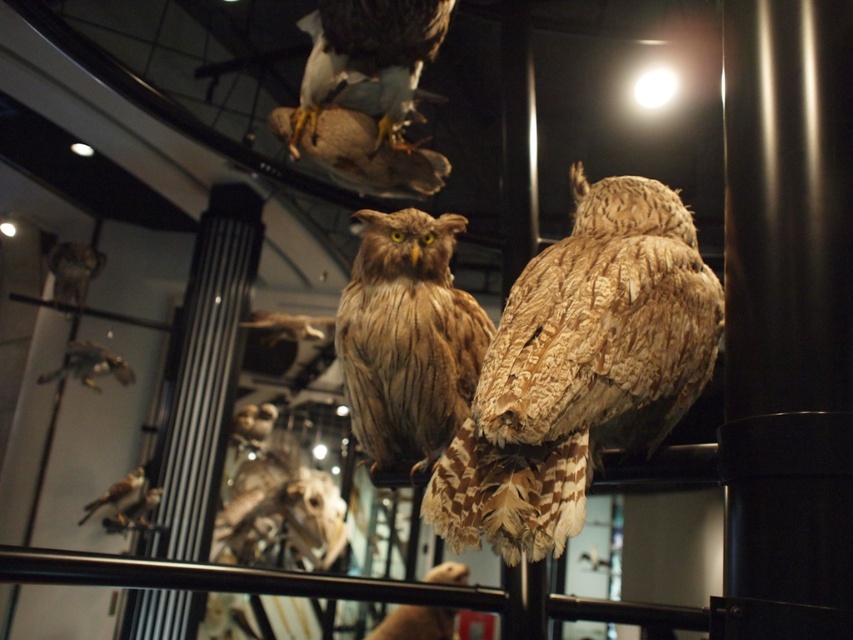
Between brown textured owl at center and brown feathered owl at lower left, which one appears on the left side from the viewer's perspective?

brown feathered owl at lower left is more to the left.

Is brown textured owl at center further to the viewer compared to brown feathered owl at lower left?

No, brown textured owl at center is closer to the viewer.

Is point (444, 385) farther from viewer compared to point (64, 376)?

No, it is not.

Locate an element on the screen. brown textured owl at center is located at coordinates (407, 337).

Does point (79, 364) come farther from viewer compared to point (129, 484)?

That is True.

You are a GUI agent. You are given a task and a screenshot of the screen. Output one action in this format:
    pyautogui.click(x=<x>, y=<y>)
    Task: Click on the brown feathered owl at lower left
    
    Given the screenshot: What is the action you would take?
    pyautogui.click(x=90, y=365)

Is point (73, 364) in front of point (85, 516)?

No, (73, 364) is further to viewer.

Identify the location of brown feathered owl at lower left. This screenshot has height=640, width=853. (90, 365).

Identify the location of brown feathered owl at upper center. The width and height of the screenshot is (853, 640). (367, 60).

Is the position of brown feathered owl at upper center more distant than that of brown speckled feathers at lower left?

No, it is not.

Between point (392, 51) and point (120, 492), which one is positioned behind?

Point (120, 492)

At what (x,y) coordinates should I click in order to perform the action: click on brown feathered owl at upper center. Please return your answer as a coordinate pair (x, y). Image resolution: width=853 pixels, height=640 pixels. Looking at the image, I should click on [x=367, y=60].